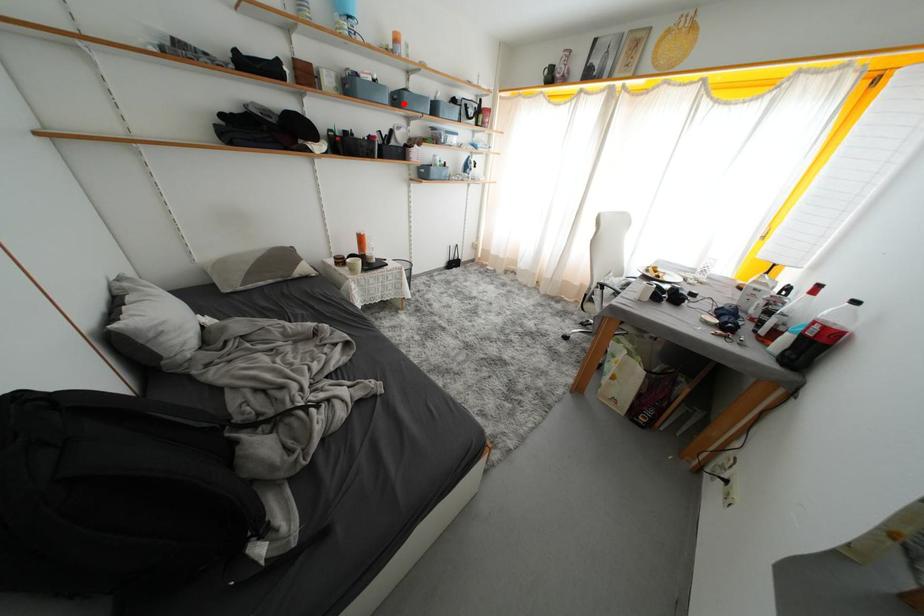
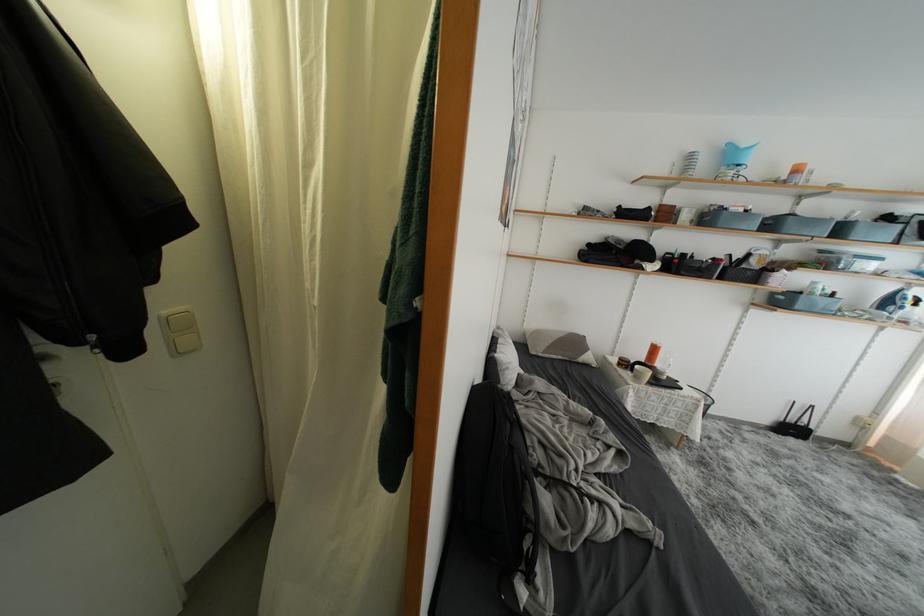
Find the pixel in the second image that matches the highlighted location in the first image.

(777, 229)